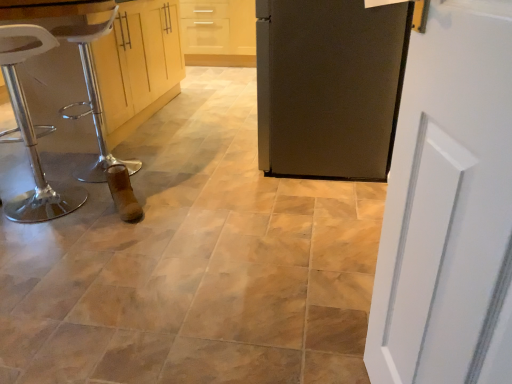
This screenshot has width=512, height=384. What are the coordinates of `vacant area that is in front of white plastic stool at left` in the screenshot? It's located at (39, 238).